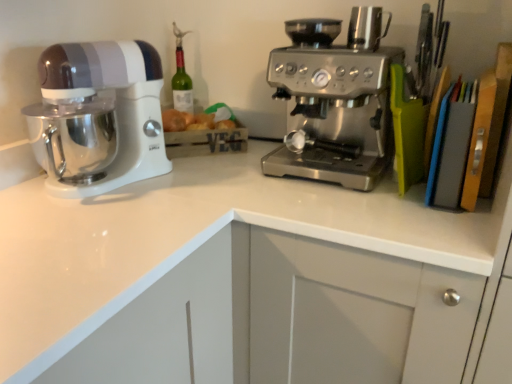
Question: Is white glossy countertop at center taller than stainless steel coffee maker at upper right?

Choices:
 (A) yes
 (B) no

Answer: (A)

Question: Is white glossy countertop at center at the left side of stainless steel coffee maker at upper right?

Choices:
 (A) no
 (B) yes

Answer: (B)

Question: Would you consider white glossy countertop at center to be distant from stainless steel coffee maker at upper right?

Choices:
 (A) no
 (B) yes

Answer: (A)

Question: Is white glossy countertop at center at the right side of stainless steel coffee maker at upper right?

Choices:
 (A) yes
 (B) no

Answer: (B)

Question: From a real-world perspective, is white glossy countertop at center under stainless steel coffee maker at upper right?

Choices:
 (A) no
 (B) yes

Answer: (B)

Question: Is point (370, 21) closer or farther from the camera than point (344, 79)?

Choices:
 (A) farther
 (B) closer

Answer: (A)

Question: From a real-world perspective, is stainless steel coffee maker at upper right physically located above or below satin silver coffee maker at center?

Choices:
 (A) above
 (B) below

Answer: (A)

Question: Is stainless steel coffee maker at upper right wider or thinner than satin silver coffee maker at center?

Choices:
 (A) wide
 (B) thin

Answer: (B)

Question: Is stainless steel coffee maker at upper right inside the boundaries of satin silver coffee maker at center, or outside?

Choices:
 (A) outside
 (B) inside

Answer: (A)

Question: From a real-world perspective, relative to white glossy mixer at left, is stainless steel coffee maker at upper right vertically above or below?

Choices:
 (A) above
 (B) below

Answer: (A)

Question: Considering the positions of stainless steel coffee maker at upper right and white glossy mixer at left in the image, is stainless steel coffee maker at upper right wider or thinner than white glossy mixer at left?

Choices:
 (A) wide
 (B) thin

Answer: (B)

Question: In terms of size, does stainless steel coffee maker at upper right appear bigger or smaller than white glossy mixer at left?

Choices:
 (A) small
 (B) big

Answer: (A)

Question: Considering the positions of point (371, 39) and point (53, 86), is point (371, 39) closer or farther from the camera than point (53, 86)?

Choices:
 (A) closer
 (B) farther

Answer: (B)

Question: From the image's perspective, relative to white glossy countertop at center, is satin silver coffee maker at center above or below?

Choices:
 (A) below
 (B) above

Answer: (B)

Question: Considering the relative positions of satin silver coffee maker at center and white glossy countertop at center in the image provided, is satin silver coffee maker at center to the left or to the right of white glossy countertop at center?

Choices:
 (A) right
 (B) left

Answer: (A)